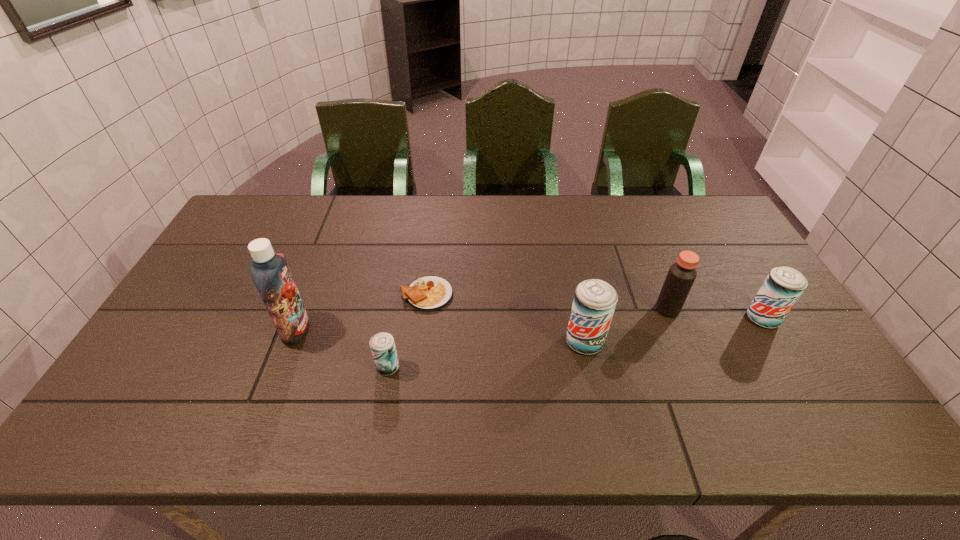
Where is `object that is the second closest one to the second beer can from left to right`? The height and width of the screenshot is (540, 960). object that is the second closest one to the second beer can from left to right is located at coordinates [428, 293].

Point out which beer can is positioned as the second nearest to the omelet. Please provide its 2D coordinates. Your answer should be formatted as a tuple, i.e. [(x, y)], where the tuple contains the x and y coordinates of a point satisfying the conditions above.

[(594, 303)]

This screenshot has height=540, width=960. What are the coordinates of `beer can that stands as the closest to the leftmost beer can` in the screenshot? It's located at (594, 303).

Identify the location of free spot that satisfies the following two spatial constraints: 1. on the front label of the leftmost beer can; 2. on the right side of the shampoo. (281, 367).

Find the location of `vacant space that satisfies the following two spatial constraints: 1. on the back side of the second beer can from left to right; 2. on the right side of the fifth object from left to right`. vacant space that satisfies the following two spatial constraints: 1. on the back side of the second beer can from left to right; 2. on the right side of the fifth object from left to right is located at coordinates (578, 309).